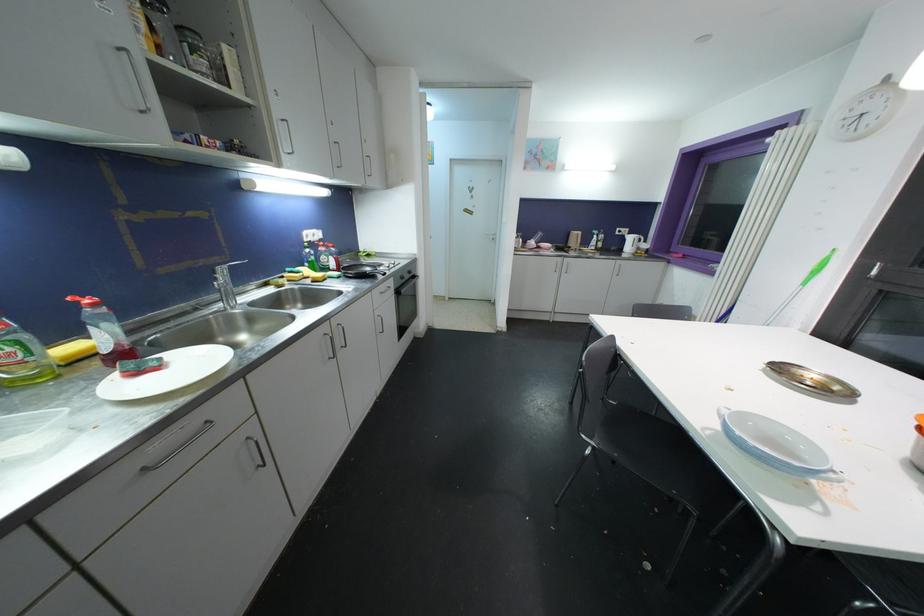
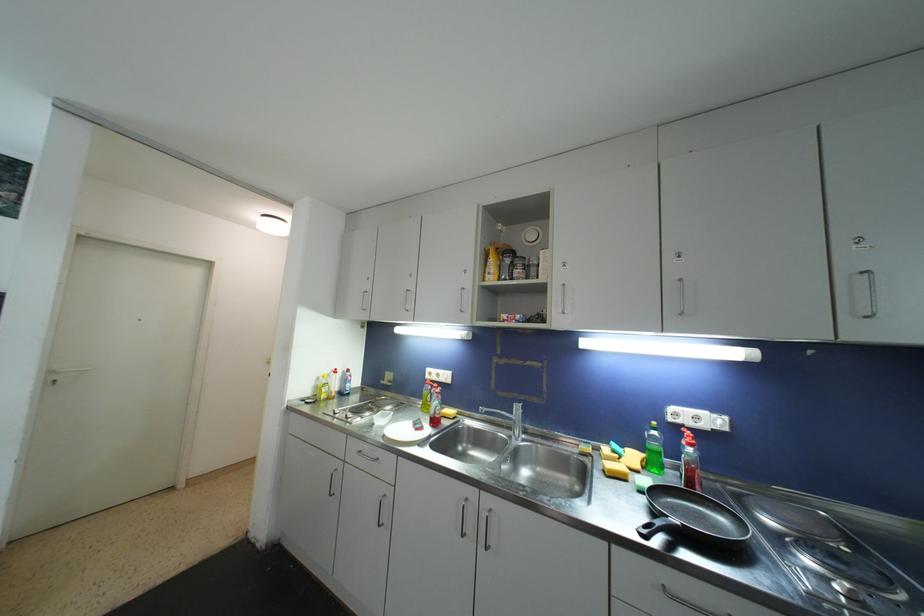
Locate, in the second image, the point that corresponds to (320,241) in the first image.

(708, 429)